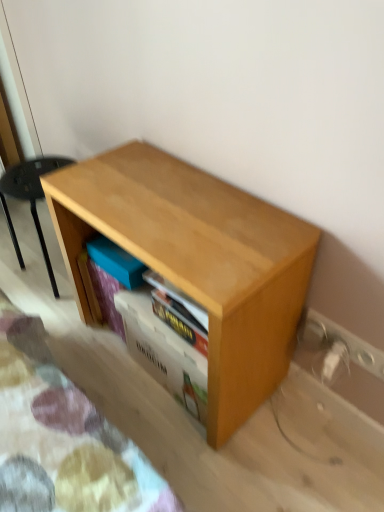
Question: Is there a large distance between white plastic electric outlet at lower right, which ranks as the 1th electric outlet in bottom-to-top order, and wooden shelf at center?

Choices:
 (A) yes
 (B) no

Answer: (B)

Question: Can you confirm if white plastic electric outlet at lower right, which ranks as the 1th electric outlet in bottom-to-top order, is taller than wooden shelf at center?

Choices:
 (A) yes
 (B) no

Answer: (B)

Question: Is white plastic electric outlet at lower right, which ranks as the 1th electric outlet in bottom-to-top order, bigger than wooden shelf at center?

Choices:
 (A) no
 (B) yes

Answer: (A)

Question: From the image's perspective, is white plastic electric outlet at lower right, which ranks as the 1th electric outlet in bottom-to-top order, under wooden shelf at center?

Choices:
 (A) yes
 (B) no

Answer: (B)

Question: From a real-world perspective, is white plastic electric outlet at lower right, which ranks as the 1th electric outlet in bottom-to-top order, below wooden shelf at center?

Choices:
 (A) yes
 (B) no

Answer: (B)

Question: Considering the relative sizes of white plastic electric outlet at lower right, which ranks as the 1th electric outlet in bottom-to-top order, and wooden shelf at center in the image provided, is white plastic electric outlet at lower right, which ranks as the 1th electric outlet in bottom-to-top order, shorter than wooden shelf at center?

Choices:
 (A) yes
 (B) no

Answer: (A)

Question: From the image's perspective, is white plastic electric outlet at lower right, which ranks as the 1th electric outlet in top-to-bottom order, under light wood table at center?

Choices:
 (A) yes
 (B) no

Answer: (A)

Question: Is white plastic electric outlet at lower right, which is counted as the second electric outlet, starting from the bottom, not within light wood table at center?

Choices:
 (A) no
 (B) yes

Answer: (B)

Question: Considering the relative positions of white plastic electric outlet at lower right, which ranks as the 1th electric outlet in top-to-bottom order, and light wood table at center in the image provided, is white plastic electric outlet at lower right, which ranks as the 1th electric outlet in top-to-bottom order, to the right of light wood table at center from the viewer's perspective?

Choices:
 (A) no
 (B) yes

Answer: (B)

Question: Is white plastic electric outlet at lower right, which is counted as the second electric outlet, starting from the bottom, looking in the opposite direction of light wood table at center?

Choices:
 (A) yes
 (B) no

Answer: (B)

Question: From the image's perspective, is white plastic electric outlet at lower right, which ranks as the 1th electric outlet in top-to-bottom order, located above light wood table at center?

Choices:
 (A) yes
 (B) no

Answer: (B)

Question: From a real-world perspective, is white plastic electric outlet at lower right, which is counted as the second electric outlet, starting from the bottom, under light wood table at center?

Choices:
 (A) no
 (B) yes

Answer: (B)

Question: Is light wood shelf at lower left not inside wooden shelf at center?

Choices:
 (A) no
 (B) yes

Answer: (B)